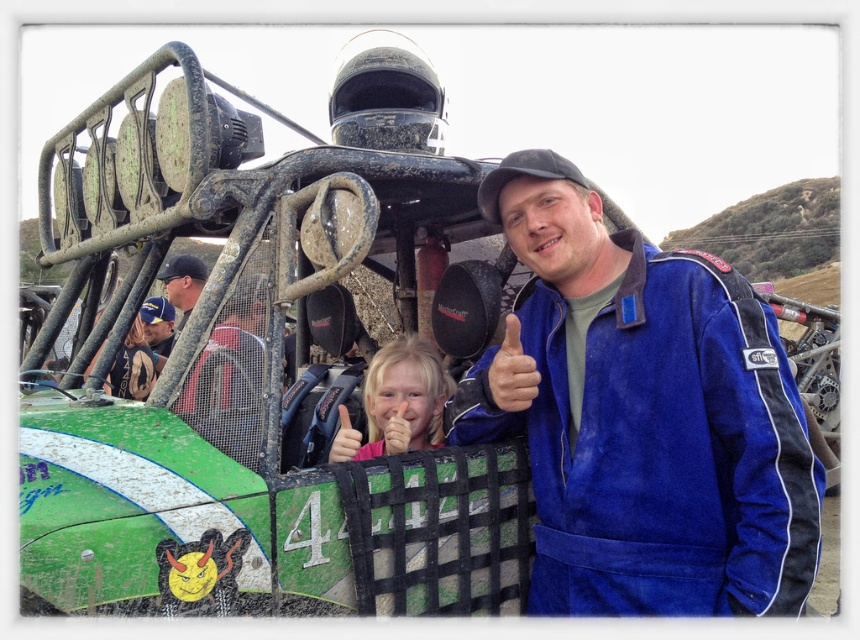
You are a photographer at the motorsport event and want to capture a photo of the blonde hair at center and the smooth skin hand at center. Based on their positions, which object is closer to the left side of the frame?

The blonde hair at center is closer to the left side of the frame because it is positioned to the left of the smooth skin hand at center.